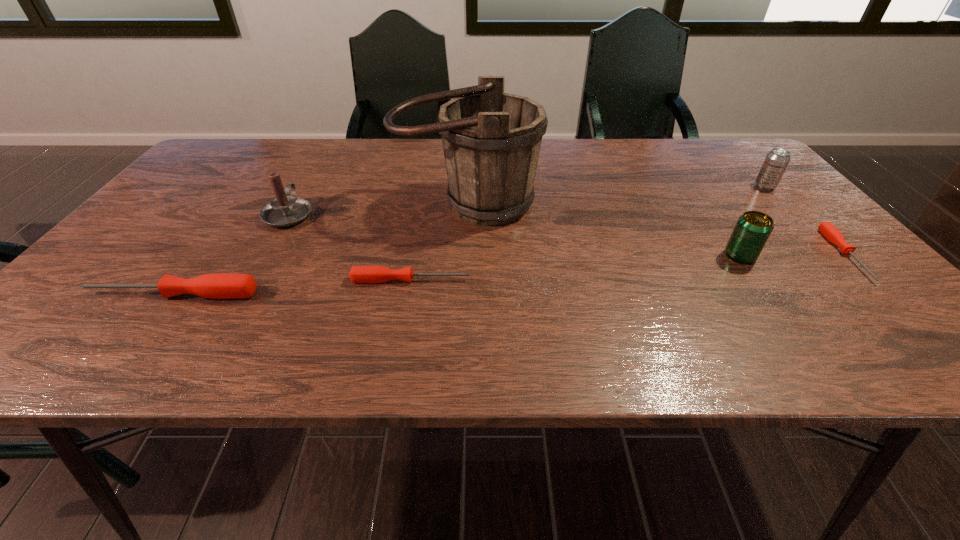
Where is `the leftmost screwdriver`? The width and height of the screenshot is (960, 540). the leftmost screwdriver is located at coordinates (218, 286).

Locate an element on the screen. the nearest screwdriver is located at coordinates (218, 286).

Find the location of a particular element. This screenshot has width=960, height=540. the second tallest screwdriver is located at coordinates (358, 274).

Identify the location of the sixth tallest object. The image size is (960, 540). (358, 274).

This screenshot has width=960, height=540. In order to click on the shortest screwdriver in this screenshot , I will do `click(830, 232)`.

You are a GUI agent. You are given a task and a screenshot of the screen. Output one action in this format:
    pyautogui.click(x=<x>, y=<y>)
    Task: Click on the shortest object
    This screenshot has height=540, width=960.
    Given the screenshot: What is the action you would take?
    pyautogui.click(x=830, y=232)

Identify the location of candle. The width and height of the screenshot is (960, 540). (285, 210).

Locate an element on the screen. This screenshot has height=540, width=960. the right beer can is located at coordinates (777, 160).

This screenshot has height=540, width=960. In order to click on the tallest object in this screenshot , I will do `click(491, 140)`.

Locate an element on the screen. the left beer can is located at coordinates (752, 230).